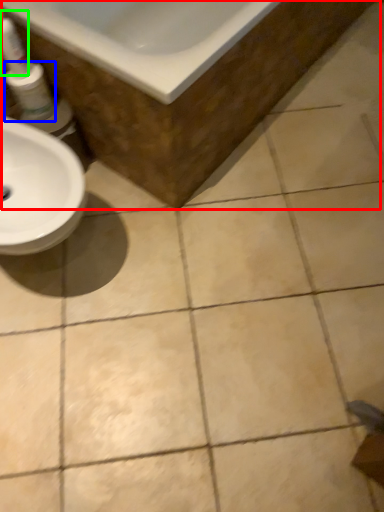
Question: Based on their relative distances, which object is farther from bath (highlighted by a red box)? Choose from mouthwash (highlighted by a blue box) and cleaning product (highlighted by a green box).

Choices:
 (A) mouthwash
 (B) cleaning product

Answer: (B)